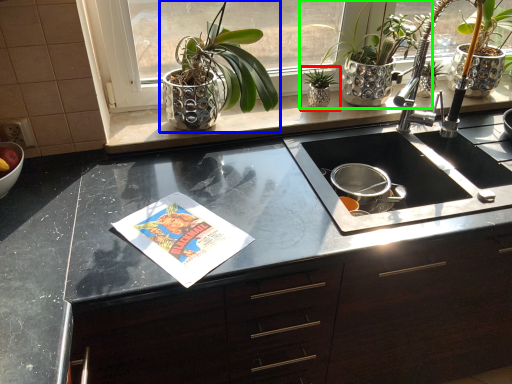
Question: Which is nearer to the houseplant (highlighted by a red box)? houseplant (highlighted by a blue box) or houseplant (highlighted by a green box).

Choices:
 (A) houseplant
 (B) houseplant

Answer: (B)